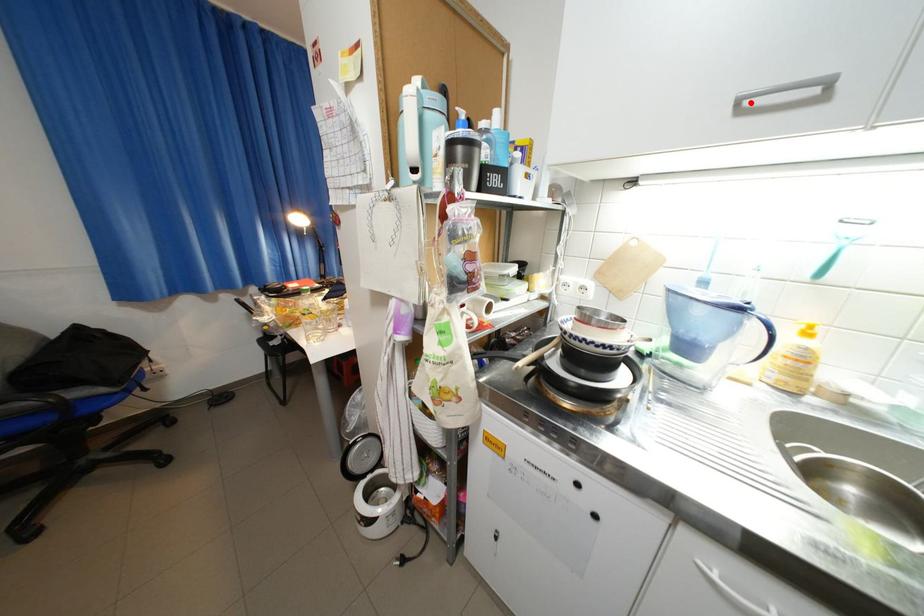
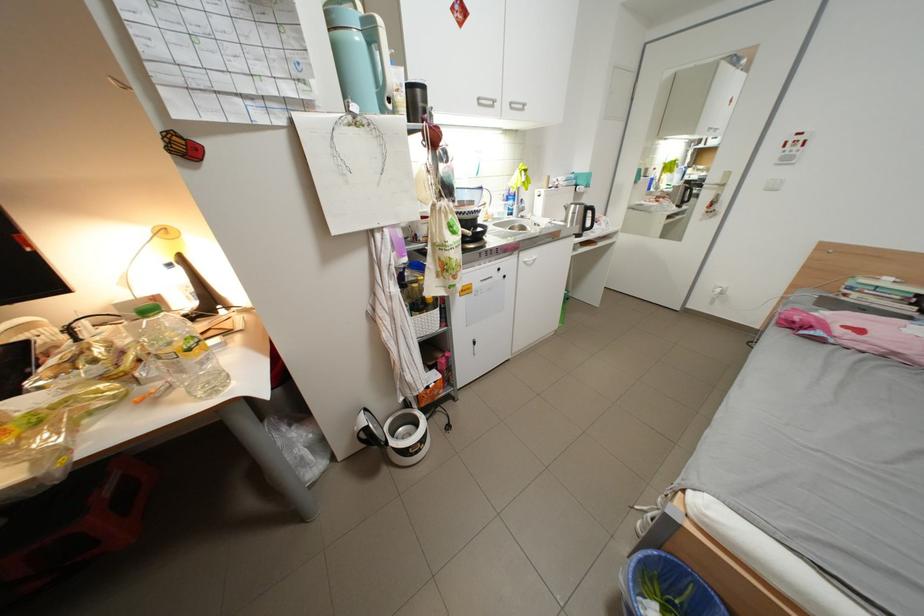
In the second image, find the point that corresponds to the highlighted location in the first image.

(490, 100)